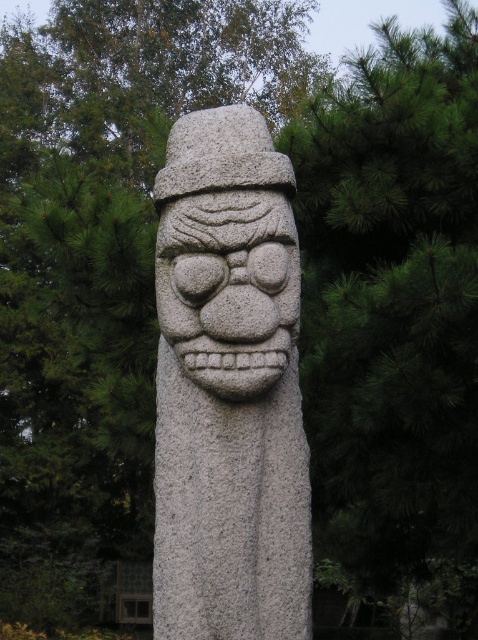
Who is lower down, gray stone statue at center or granite stone face at center?

Positioned lower is gray stone statue at center.

Who is positioned more to the left, gray stone statue at center or granite stone face at center?

From the viewer's perspective, gray stone statue at center appears more on the left side.

Identify the location of gray stone statue at center. This screenshot has height=640, width=478. (228, 388).

Identify the location of gray stone statue at center. (228, 388).